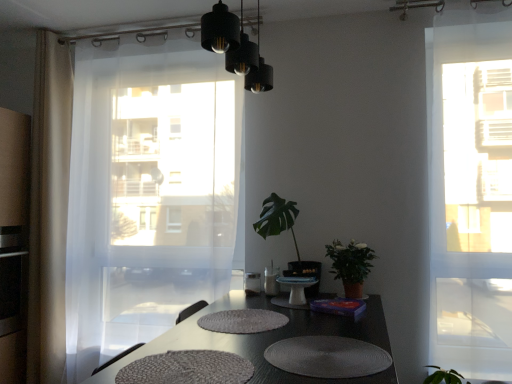
Find the location of a particular element. This screenshot has width=512, height=384. free space that is in between white textured placemat at lower center, arranged as the 1th wide when viewed from the right, and white textured placemat at center is located at coordinates (266, 338).